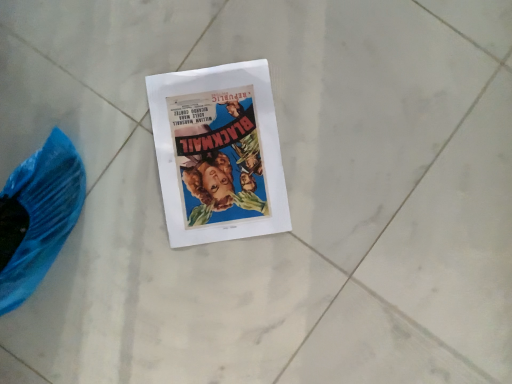
The height and width of the screenshot is (384, 512). What are the coordinates of `empty space that is ontop of matte paper poster at center (from a real-world perspective)` in the screenshot? It's located at (217, 152).